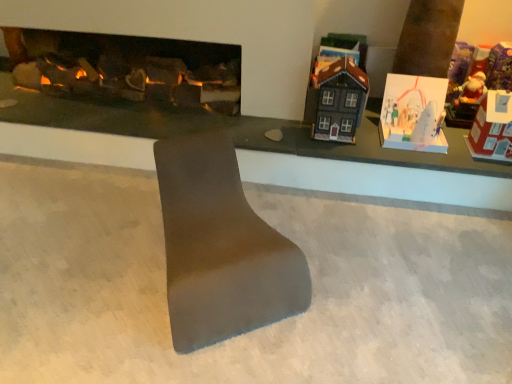
Where is `free point to the left of matte gray footrest at center`? free point to the left of matte gray footrest at center is located at coordinates (83, 256).